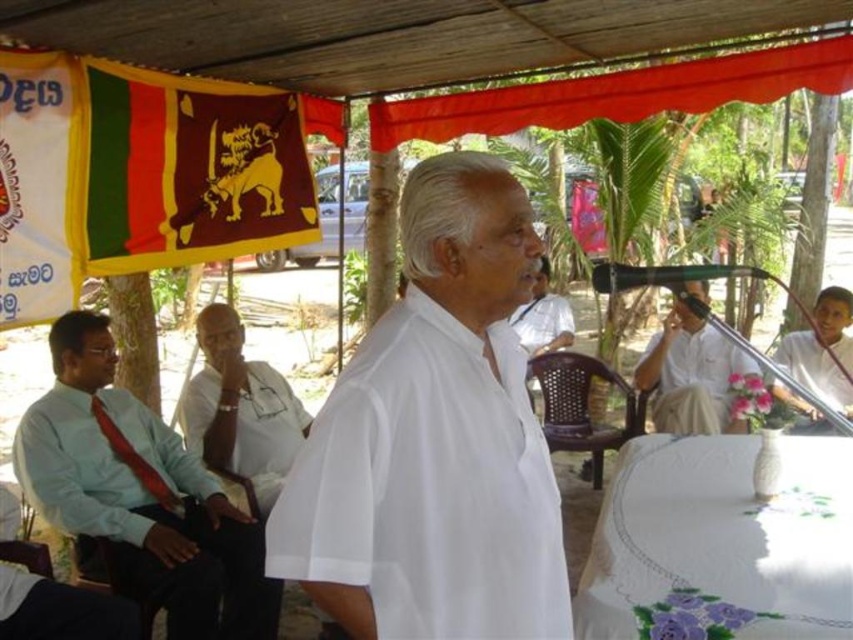
Question: Considering the real-world distances, which object is closest to the white embroidered tablecloth at lower right?

Choices:
 (A) yellow fabric flag at upper left
 (B) white cotton shirt at center
 (C) white cotton robe at center

Answer: (B)

Question: Estimate the real-world distances between objects in this image. Which object is farther from the white matte shirt at center?

Choices:
 (A) light blue shirt at left
 (B) green matte microphone at center
 (C) white cotton shirt at center

Answer: (C)

Question: Observing the image, what is the correct spatial positioning of white matte shirt at center in reference to white fabric at right?

Choices:
 (A) right
 (B) left

Answer: (B)

Question: Can you confirm if white matte shirt at center is positioned to the left of white fabric at right?

Choices:
 (A) yes
 (B) no

Answer: (A)

Question: In this image, where is white embroidered tablecloth at lower right located relative to matte fabric flag at upper center?

Choices:
 (A) below
 (B) above

Answer: (A)

Question: Among these points, which one is nearest to the camera?

Choices:
 (A) (402, 248)
 (B) (155, 595)

Answer: (A)